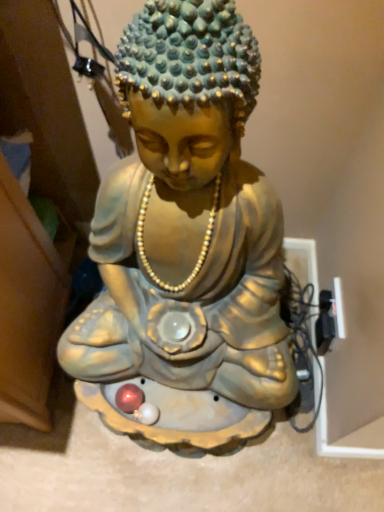
Identify the location of matte gold statue at center. The width and height of the screenshot is (384, 512). (187, 221).

Describe the element at coordinates (187, 221) in the screenshot. The image size is (384, 512). I see `matte gold statue at center` at that location.

Where is `matte gold statue at center`? This screenshot has width=384, height=512. matte gold statue at center is located at coordinates (187, 221).